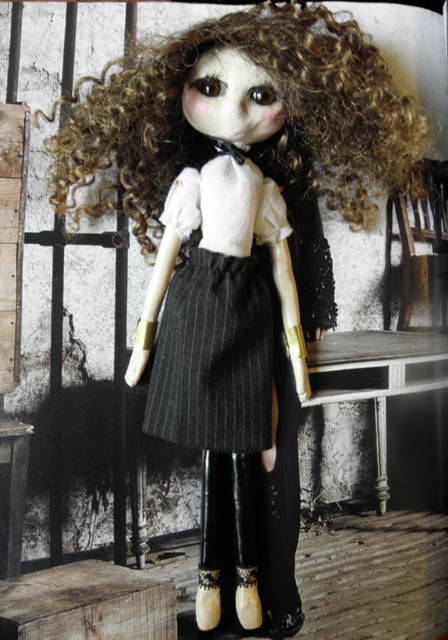
Based on the scene description, if you were to look at the doll from the front, which object would appear closer to you between the curly blonde hair at center and the dark gray pinstriped skirt at center?

The curly blonde hair at center appears closer because it is positioned in front of the dark gray pinstriped skirt at center.

You are a photographer setting up a camera in the room where the doll is displayed. You need to position two markers at the coordinates point (134, 76) and point (241, 189). From your perspective, which marker is closer to the camera?

Point (134, 76) is in front of point (241, 189), so the marker at point (134, 76) is closer to the camera.

Based on the description, which object is positioned to the right of the other? The curly blonde hair at center or the dark gray pinstriped skirt at center?

The curly blonde hair at center is positioned to the right of the dark gray pinstriped skirt at center.